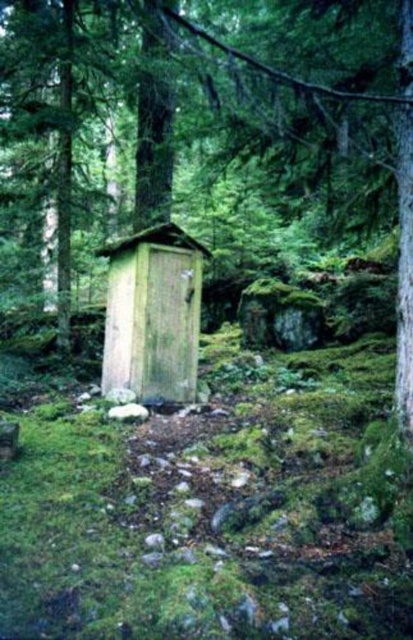
Is smooth wooden outhouse at center above wooden hut at center?

Yes.

Which is below, smooth wooden outhouse at center or wooden hut at center?

wooden hut at center is below.

Is point (187, 108) positioned after point (109, 317)?

Yes, point (187, 108) is behind point (109, 317).

I want to click on smooth wooden outhouse at center, so click(x=299, y=115).